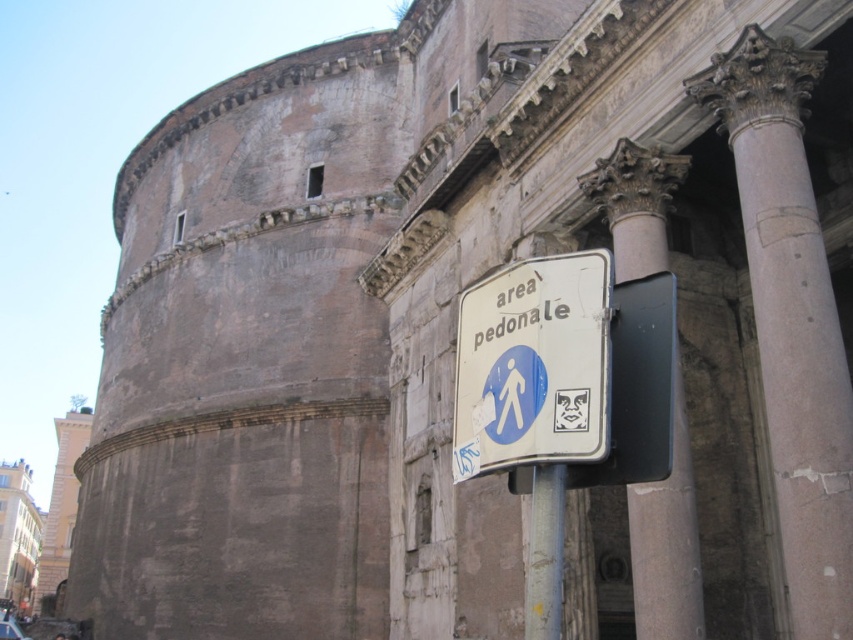
Question: Is marble column at center above light beige stone tower at left?

Choices:
 (A) yes
 (B) no

Answer: (A)

Question: Does marble column at center appear under metallic pole at lower center?

Choices:
 (A) no
 (B) yes

Answer: (A)

Question: Which point appears farthest from the camera in this image?

Choices:
 (A) (543, 524)
 (B) (61, 472)

Answer: (B)

Question: Based on their relative distances, which object is farther from the metallic pole at lower center?

Choices:
 (A) light beige stone tower at left
 (B) marble column at center
 (C) smooth gray stone column at center

Answer: (A)

Question: Considering the real-world distances, which object is closest to the light beige stone tower at left?

Choices:
 (A) marble column at center
 (B) white paper sign at center

Answer: (A)

Question: Is white paper sign at center closer to camera compared to metallic pole at lower center?

Choices:
 (A) no
 (B) yes

Answer: (A)